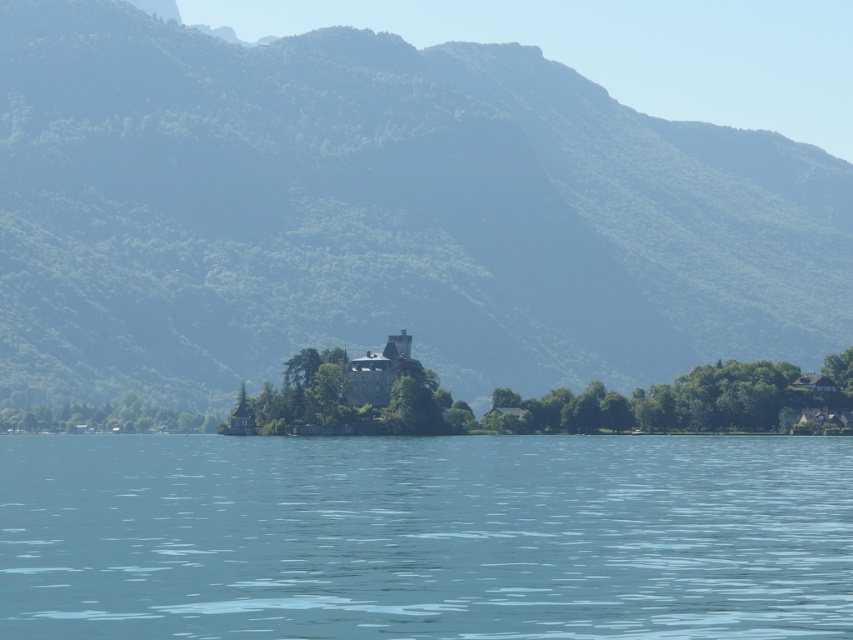
You are an architect planning to build a new observation deck. You need to choose between the green textured mountain at center and the dark gray stone castle at center as the base. Which location has a wider base to accommodate the deck?

The green textured mountain at center has a wider base than the dark gray stone castle at center, so it can accommodate the observation deck better.

You are an architect planning to build a new observatory on the largest structure in the scene. Which structure should you choose between the green textured mountain at center and the dark gray stone castle at center?

The green textured mountain at center is larger than the dark gray stone castle at center, so you should choose the green textured mountain at center for building the observatory.

You are standing on the shore of the lake and see the transparent blue water at center and the dark gray stone castle at center. Which object is positioned to the right side from your perspective?

The transparent blue water at center is to the right of the dark gray stone castle at center.